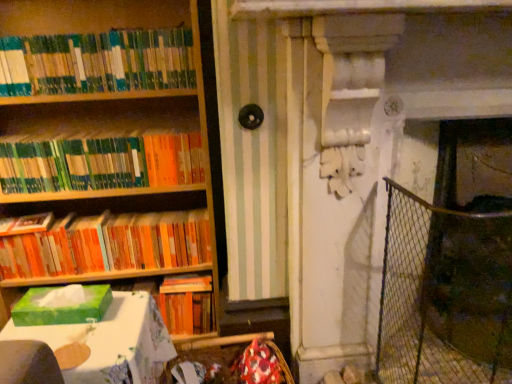
At what (x,y) coordinates should I click in order to perform the action: click on empty space that is ontop of green cardboard tissue box at lower left. Please return your answer as a coordinate pair (x, y). The image size is (512, 384). Looking at the image, I should click on (84, 326).